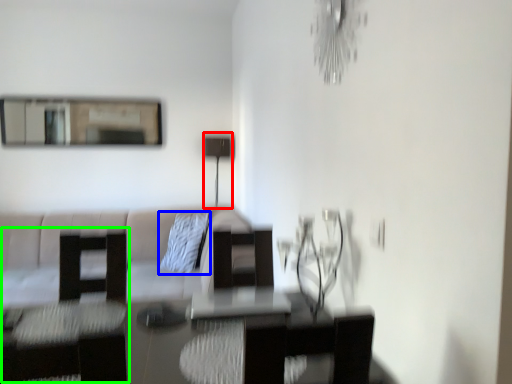
Question: Which is nearer to the lamp (highlighted by a red box)? pillow (highlighted by a blue box) or swivel chair (highlighted by a green box).

Choices:
 (A) pillow
 (B) swivel chair

Answer: (A)